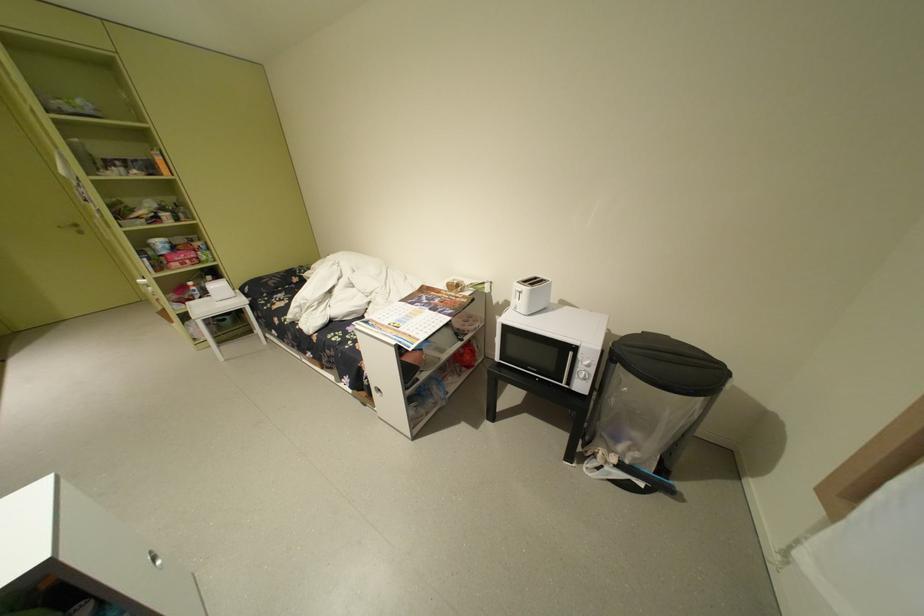
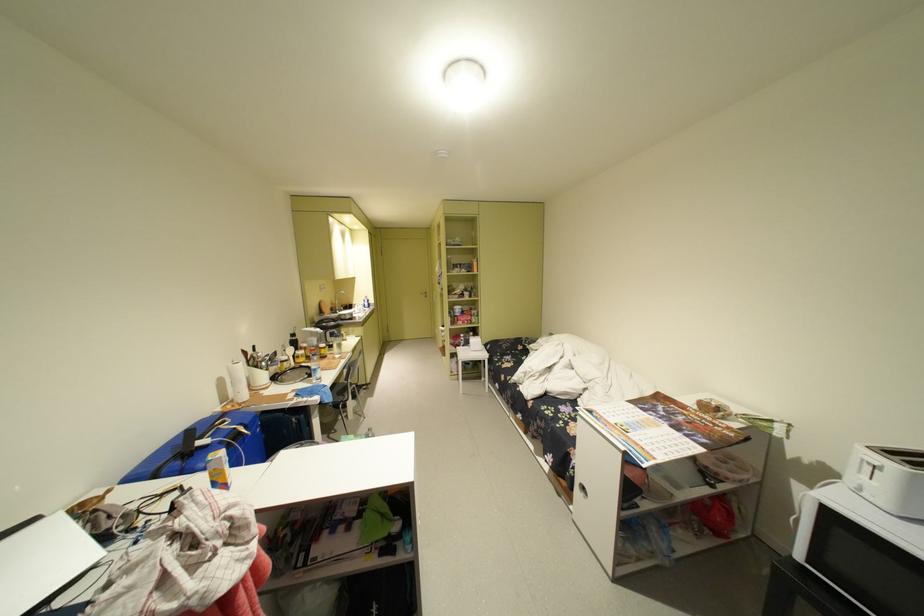
Where in the second image is the point corresponding to (x=529, y=292) from the first image?

(881, 464)